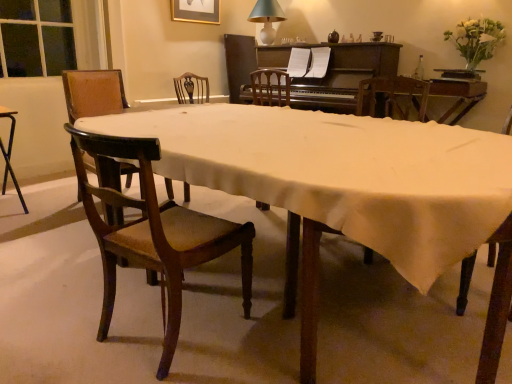
Question: Based on their sizes in the image, would you say mahogany wood chair at lower left, the second chair positioned from the back, is bigger or smaller than black metal desk at left?

Choices:
 (A) small
 (B) big

Answer: (B)

Question: Is mahogany wood chair at lower left, the first chair viewed from the front, to the left or to the right of black metal desk at left in the image?

Choices:
 (A) right
 (B) left

Answer: (A)

Question: Which object is positioned farthest from the mahogany wood chair at lower left, the second chair positioned from the back?

Choices:
 (A) white ceramic lamp at upper center
 (B) gold-framed picture at upper center
 (C) black metal desk at left
 (D) dark brown polished wood piano at upper center
 (E) wooden table at center

Answer: (A)

Question: Estimate the real-world distances between objects in this image. Which object is farther from the mahogany wood chair at lower left, the second chair from the left?

Choices:
 (A) white matte flowers at upper right
 (B) black metal desk at left
 (C) wooden table at center
 (D) wooden chair at left, which appears as the second chair when viewed from the right
 (E) white ceramic lamp at upper center

Answer: (E)